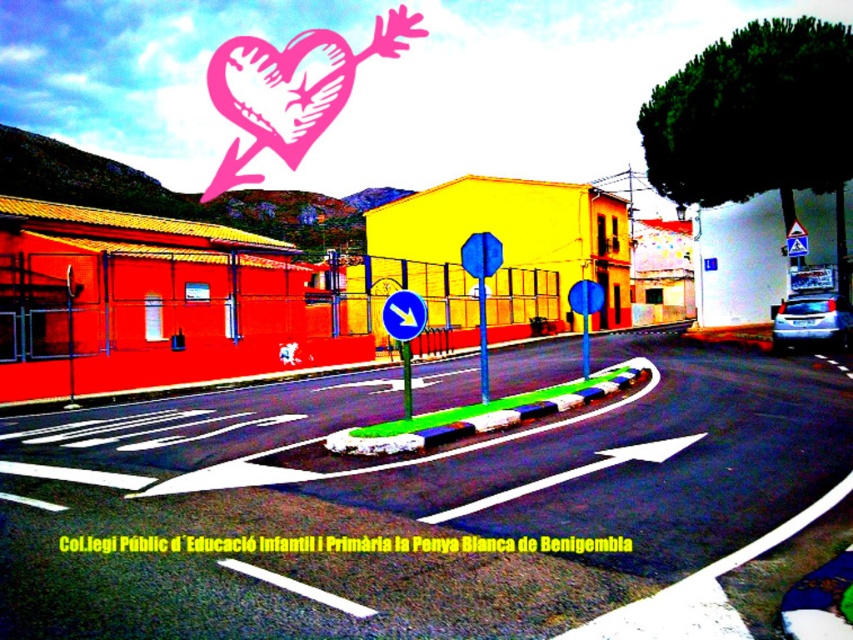
Question: Is pink paper heart at upper center below blue plastic traffic sign at center?

Choices:
 (A) yes
 (B) no

Answer: (B)

Question: Which point is closer to the camera?

Choices:
 (A) pink paper heart at upper center
 (B) blue plastic traffic sign at center

Answer: (B)

Question: Does pink paper heart at upper center appear on the right side of blue plastic traffic sign at center?

Choices:
 (A) no
 (B) yes

Answer: (A)

Question: Which point is farther from the camera taking this photo?

Choices:
 (A) (302, 60)
 (B) (387, 308)

Answer: (A)

Question: Does pink paper heart at upper center appear over blue plastic traffic sign at center?

Choices:
 (A) no
 (B) yes

Answer: (B)